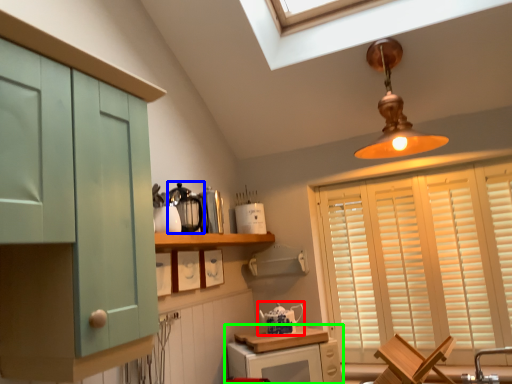
Question: Which is nearer to the tea pot (highlighted by a red box)? appliance (highlighted by a blue box) or cabinetry (highlighted by a green box).

Choices:
 (A) appliance
 (B) cabinetry

Answer: (B)